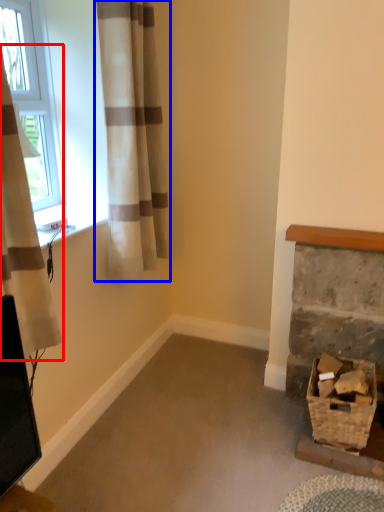
Question: Which object appears farthest to the camera in this image, curtain (highlighted by a red box) or curtain (highlighted by a blue box)?

Choices:
 (A) curtain
 (B) curtain

Answer: (B)